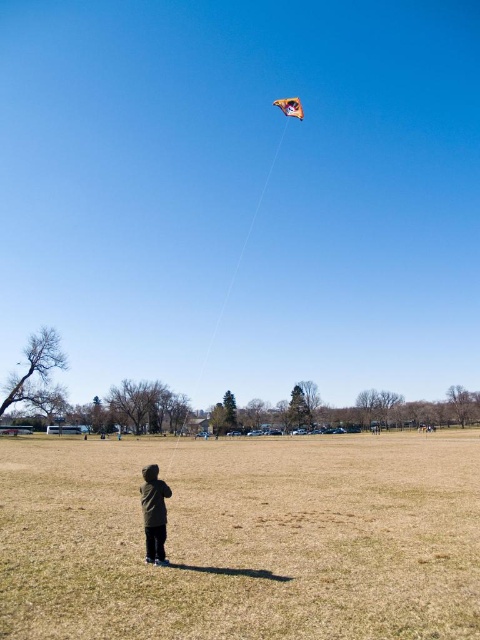
Between point (294, 625) and point (165, 557), which one is positioned in front?

Point (294, 625)

Which is in front, point (240, 548) or point (164, 506)?

Point (164, 506) is in front.

Find the location of a particular element. brown grass at center is located at coordinates (243, 540).

Between brown grass at center and orange fabric kite at upper center, which one has more height?

With more height is orange fabric kite at upper center.

Based on the photo, how far apart are brown grass at center and orange fabric kite at upper center?

brown grass at center is 40.23 meters from orange fabric kite at upper center.

Between point (105, 541) and point (300, 108), which one is positioned behind?

The point (300, 108) is more distant.

Where is `brown grass at center`? Image resolution: width=480 pixels, height=640 pixels. brown grass at center is located at coordinates (243, 540).

Consider the image. Is dark green jacket at center to the left of orange fabric kite at upper center from the viewer's perspective?

Indeed, dark green jacket at center is positioned on the left side of orange fabric kite at upper center.

Is point (147, 541) positioned after point (287, 97)?

No.

Locate an element on the screen. This screenshot has height=640, width=480. dark green jacket at center is located at coordinates (154, 513).